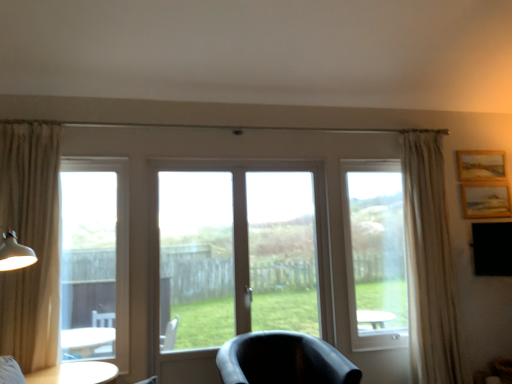
Question: From the image's perspective, is transparent glass screen door at center beneath matte white table lamp at left?

Choices:
 (A) yes
 (B) no

Answer: (B)

Question: Does transparent glass screen door at center have a lesser width compared to matte white table lamp at left?

Choices:
 (A) yes
 (B) no

Answer: (A)

Question: From the image's perspective, does transparent glass screen door at center appear higher than matte white table lamp at left?

Choices:
 (A) yes
 (B) no

Answer: (A)

Question: Can you confirm if transparent glass screen door at center is wider than matte white table lamp at left?

Choices:
 (A) no
 (B) yes

Answer: (A)

Question: Is transparent glass screen door at center at the right side of matte white table lamp at left?

Choices:
 (A) no
 (B) yes

Answer: (B)

Question: Would you consider transparent glass screen door at center to be distant from matte white table lamp at left?

Choices:
 (A) yes
 (B) no

Answer: (A)

Question: Can you confirm if transparent glass screen door at center is positioned to the right of white glossy table at lower left?

Choices:
 (A) yes
 (B) no

Answer: (A)

Question: Is transparent glass screen door at center in front of white glossy table at lower left?

Choices:
 (A) no
 (B) yes

Answer: (A)

Question: Is transparent glass screen door at center behind white glossy table at lower left?

Choices:
 (A) no
 (B) yes

Answer: (B)

Question: Is transparent glass screen door at center positioned with its back to white glossy table at lower left?

Choices:
 (A) yes
 (B) no

Answer: (B)

Question: Is transparent glass screen door at center facing towards white glossy table at lower left?

Choices:
 (A) no
 (B) yes

Answer: (A)

Question: From the image's perspective, is transparent glass screen door at center above white glossy table at lower left?

Choices:
 (A) yes
 (B) no

Answer: (A)

Question: Is wooden textured picture frame at upper right, positioned as the second picture frame in top-to-bottom order, to the left of clear glass window at left from the viewer's perspective?

Choices:
 (A) no
 (B) yes

Answer: (A)